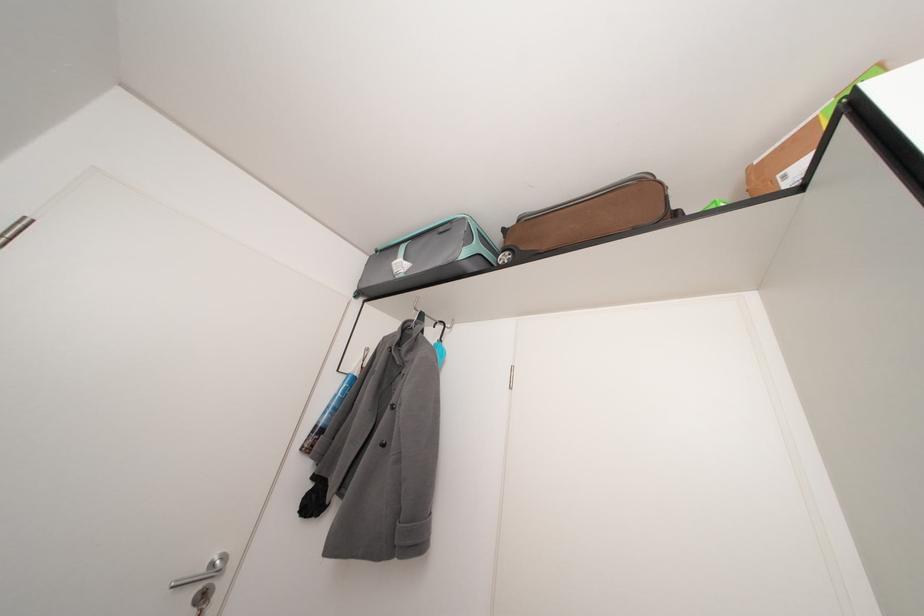
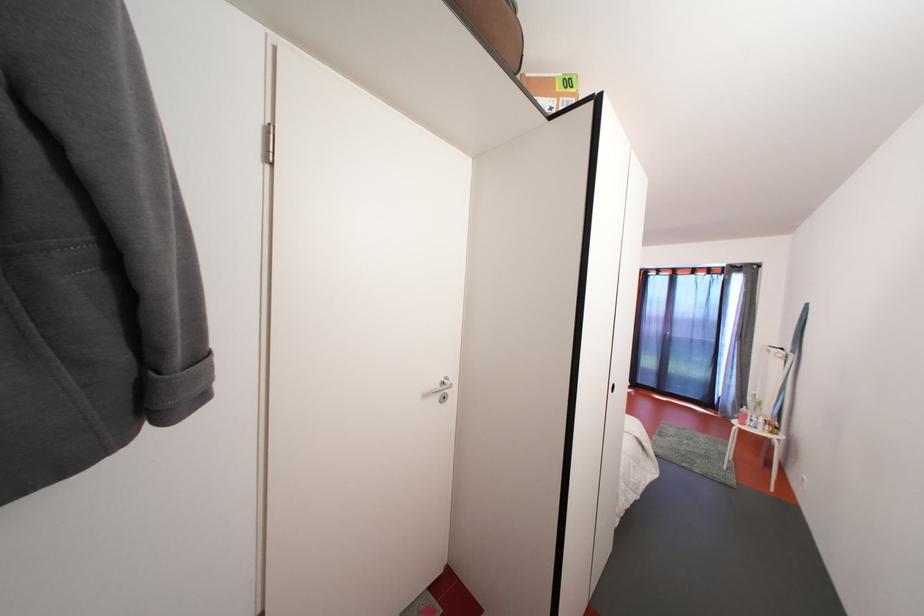
First-person continuous shooting, in which direction is the camera rotating?

The camera rotated toward right-down.